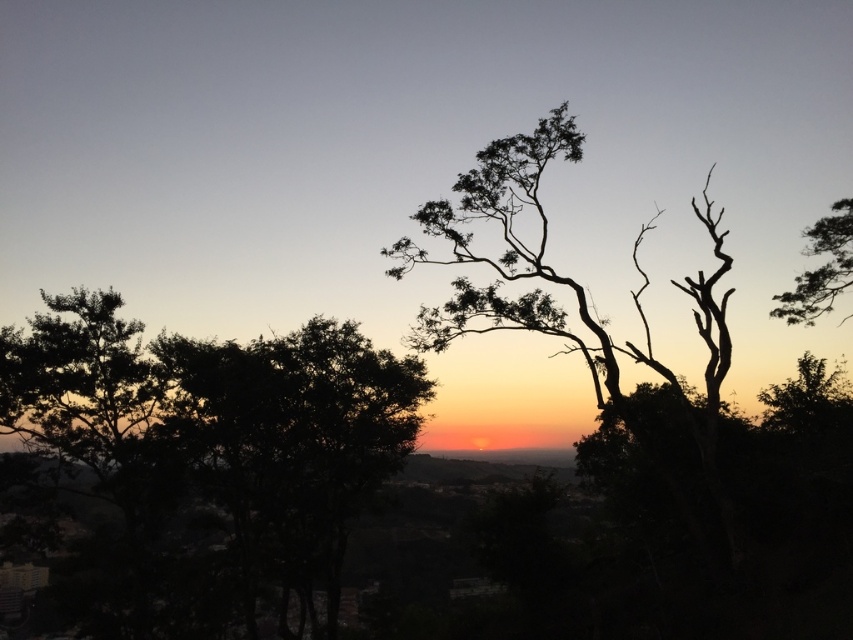
Is dark green leafy tree at center above silhouette bark tree at upper right?

Actually, dark green leafy tree at center is below silhouette bark tree at upper right.

Can you confirm if dark green leafy tree at center is bigger than silhouette bark tree at upper right?

No, dark green leafy tree at center is not bigger than silhouette bark tree at upper right.

Identify the location of dark green leafy tree at center. tap(294, 449).